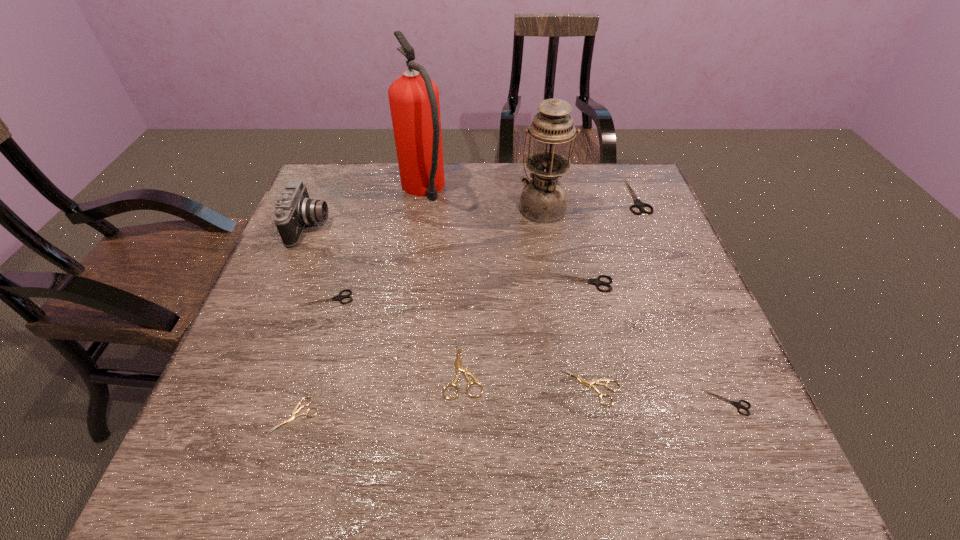
This screenshot has width=960, height=540. I want to click on free space located 0.120m on the front of the leftmost black shears, so click(311, 348).

You are a GUI agent. You are given a task and a screenshot of the screen. Output one action in this format:
    pyautogui.click(x=<x>, y=<y>)
    Task: Click on the vacant space located 0.140m on the left of the biggest beige shears
    
    Given the screenshot: What is the action you would take?
    pyautogui.click(x=377, y=367)

The image size is (960, 540). I want to click on vacant region located on the right of the second biggest beige shears, so click(695, 387).

Image resolution: width=960 pixels, height=540 pixels. What are the coordinates of `free space located on the left of the smallest black shears` in the screenshot? It's located at (587, 402).

Image resolution: width=960 pixels, height=540 pixels. I want to click on free region located on the back of the smallest beige shears, so click(x=336, y=282).

Identify the location of fire extinguisher at the far edge. (414, 102).

This screenshot has height=540, width=960. Identify the location of oil lamp that is positioned at the far edge. (543, 199).

I want to click on camera situated at the far edge, so pyautogui.click(x=294, y=209).

Where is `shears that is at the far edge`? shears that is at the far edge is located at coordinates (639, 204).

The height and width of the screenshot is (540, 960). Find the location of `camera at the left edge`. camera at the left edge is located at coordinates (294, 209).